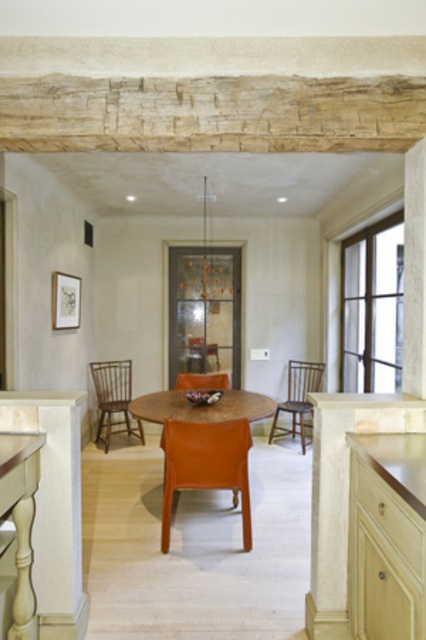
Can you confirm if wooden countertop at right is smaller than orange leather chair at center?

Actually, wooden countertop at right might be larger than orange leather chair at center.

You are a GUI agent. You are given a task and a screenshot of the screen. Output one action in this format:
    pyautogui.click(x=<x>, y=<y>)
    Task: Click on the wooden countertop at right
    Image resolution: width=426 pixels, height=640 pixels.
    Given the screenshot: What is the action you would take?
    pyautogui.click(x=386, y=536)

Between orange leather chair at center and wooden spindle back chair at left, which one has more height?

Standing taller between the two is wooden spindle back chair at left.

Locate an element on the screen. orange leather chair at center is located at coordinates (206, 465).

Consider the image. Between orange leather chair at center and wooden chair at center, which one is positioned higher?

wooden chair at center is above.

Does point (241, 420) come behind point (317, 372)?

No, (241, 420) is closer to viewer.

Where is `orange leather chair at center`? orange leather chair at center is located at coordinates (206, 465).